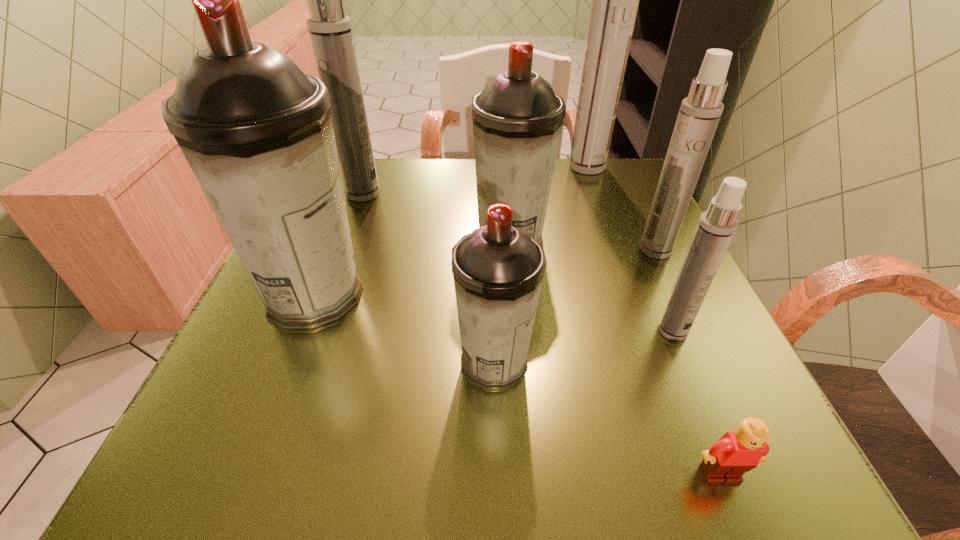
I want to click on the shortest object, so click(736, 452).

The image size is (960, 540). I want to click on free location located 0.150m on the front of the farthest object, so click(603, 210).

Identify the location of free space located on the right of the second farthest object. The width and height of the screenshot is (960, 540). (441, 194).

Locate an element on the screen. The image size is (960, 540). free space located 0.070m on the front of the biggest gray aerosol can is located at coordinates (x=283, y=373).

Locate an element on the screen. The image size is (960, 540). vacant position located 0.150m on the left of the second nearest white aerosol can is located at coordinates (563, 250).

Identify the location of vacant space situated on the right of the second biggest gray aerosol can. (x=608, y=240).

Identify the location of vacant region located 0.180m on the back of the smallest white aerosol can. This screenshot has height=540, width=960. (639, 252).

Identify the location of free space located 0.250m on the right of the smallest gray aerosol can. (700, 363).

Locate an element on the screen. This screenshot has width=960, height=540. object present at the near edge is located at coordinates (736, 452).

The height and width of the screenshot is (540, 960). In order to click on Lego positioned at the right edge in this screenshot , I will do `click(736, 452)`.